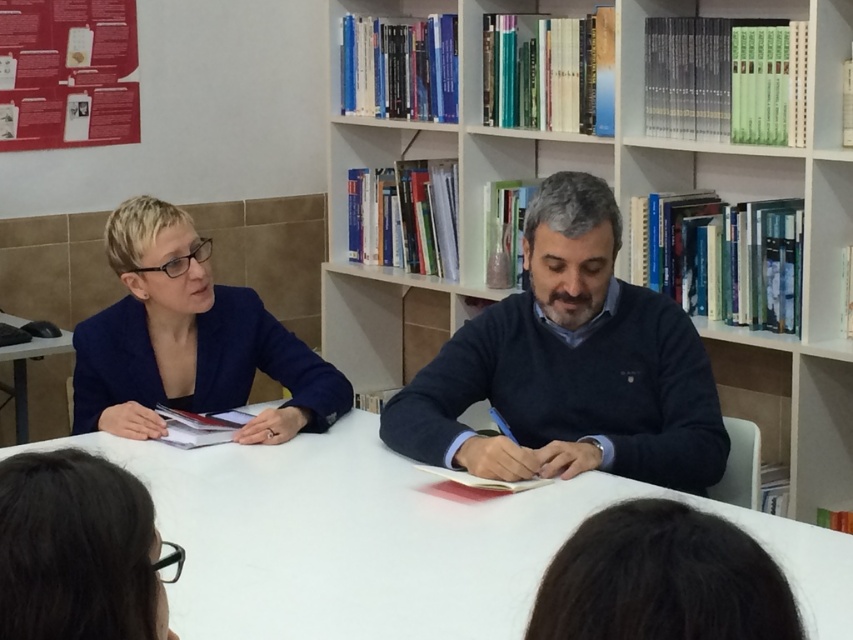
Question: Can you confirm if white smooth table at center is positioned above dark blue sweater at center?

Choices:
 (A) yes
 (B) no

Answer: (B)

Question: Is wooden bookshelf at center below dark brown hair at lower left?

Choices:
 (A) yes
 (B) no

Answer: (B)

Question: Which point is closer to the camera?

Choices:
 (A) (16, 396)
 (B) (106, 330)
 (C) (682, 140)

Answer: (B)

Question: Among these points, which one is nearest to the camera?

Choices:
 (A) (201, 512)
 (B) (0, 353)

Answer: (A)

Question: Observing the image, what is the correct spatial positioning of white smooth table at center in reference to black plastic mouse at lower left?

Choices:
 (A) below
 (B) above

Answer: (A)

Question: Which object appears closest to the camera in this image?

Choices:
 (A) white smooth table at center
 (B) wooden bookshelf at center

Answer: (A)